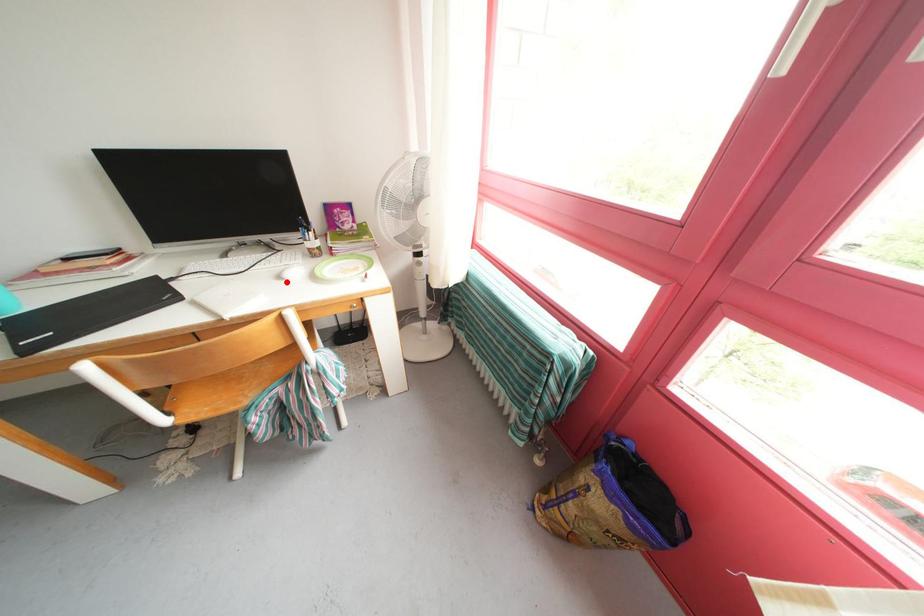
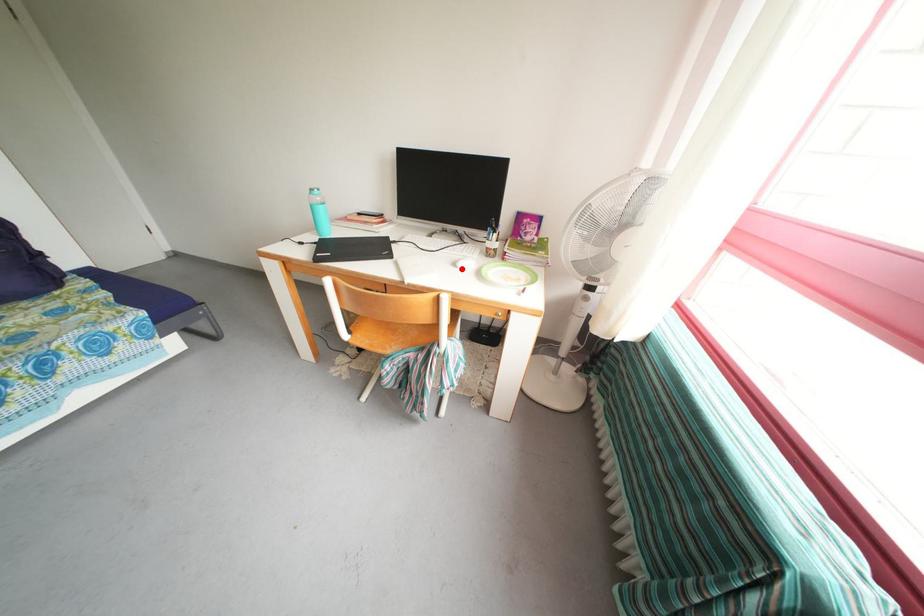
Looking at this image, I am providing you with two images of the same scene from different viewpoints. A red point is marked on the first image and another point is marked on the second image. Are the points marked in image1 and image2 representing the same 3D position?

Yes